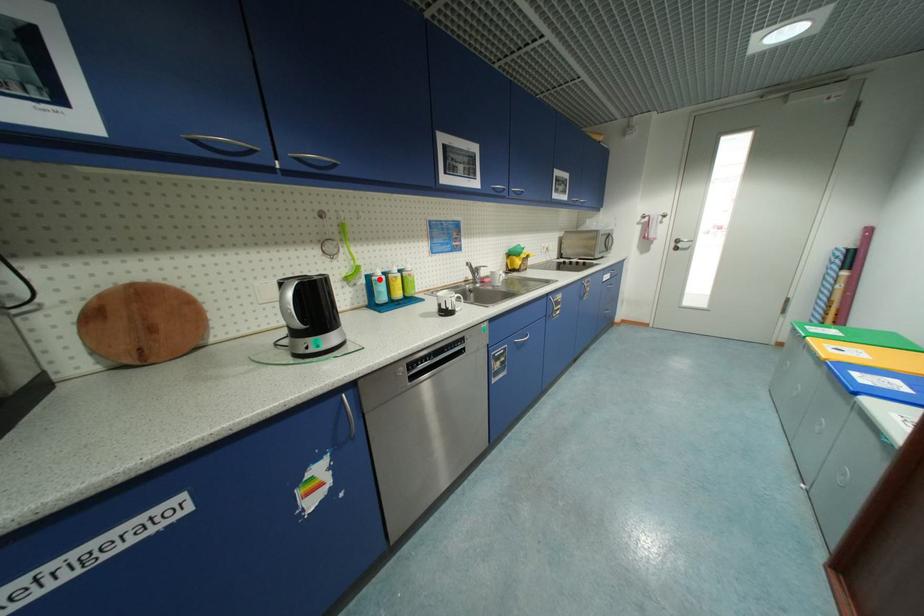
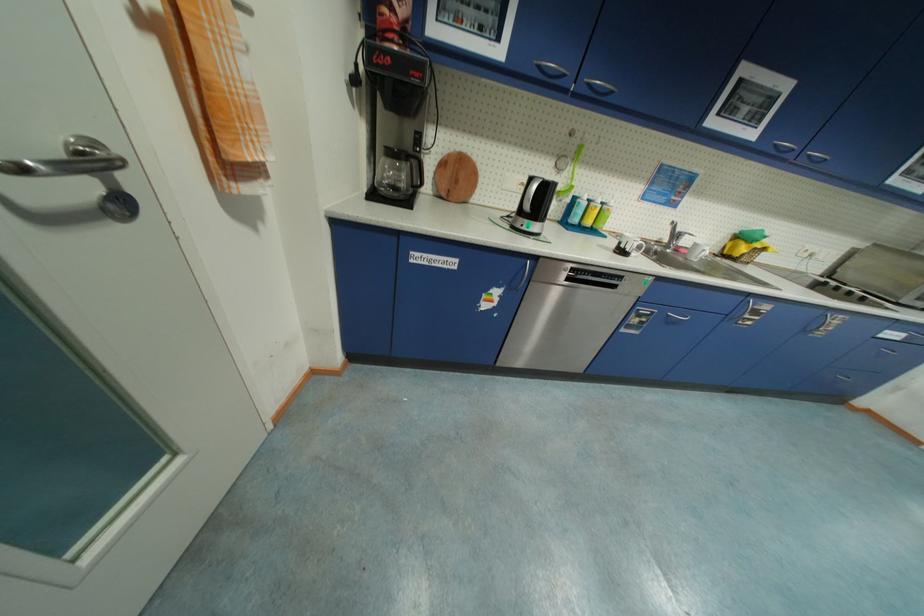
Question: I am providing you with two images of the same scene from different viewpoints. Image1 has a red point marked. In image2, the corresponding 3D location appears at what relative position? Reply with the corresponding letter.

Choices:
 (A) Closer
 (B) Farther

Answer: (A)